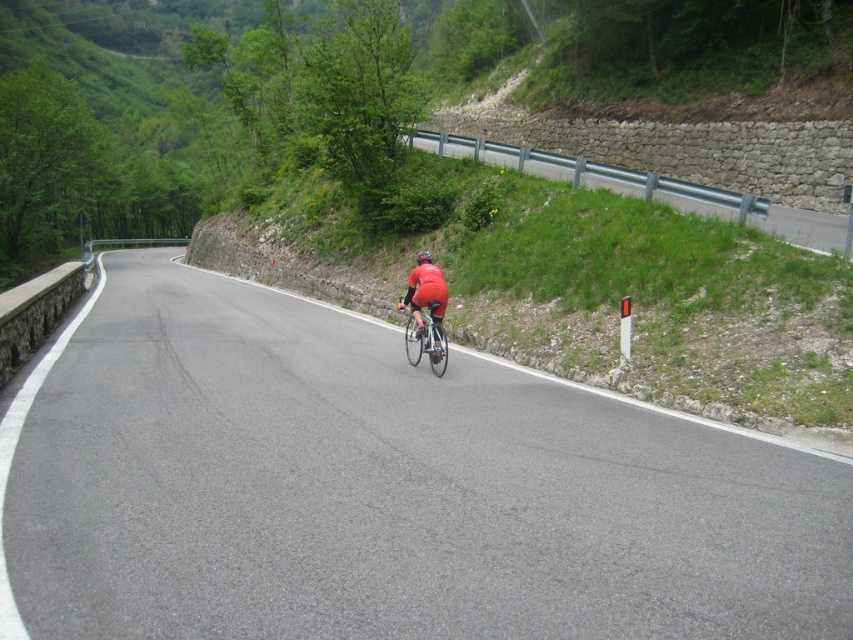
Does shiny metallic bicycle at center appear under matte red helmet at center?

Correct, shiny metallic bicycle at center is located below matte red helmet at center.

How much distance is there between shiny metallic bicycle at center and matte red helmet at center?

shiny metallic bicycle at center and matte red helmet at center are 1.66 meters apart from each other.

Is point (444, 348) positioned behind point (422, 259)?

No, it is in front of (422, 259).

The height and width of the screenshot is (640, 853). I want to click on shiny metallic bicycle at center, so click(425, 339).

Between point (764, 570) and point (415, 307), which one is positioned in front?

Point (764, 570)

From the picture: Which of these two, asphalt road at center or matte red cycling suit at center, stands taller?

asphalt road at center is taller.

Who is more forward, (x=200, y=468) or (x=437, y=289)?

Point (x=200, y=468) is more forward.

Locate an element on the screen. asphalt road at center is located at coordinates (381, 488).

In the scene shown: Can you confirm if asphalt road at center is taller than shiny metallic bicycle at center?

Yes, asphalt road at center is taller than shiny metallic bicycle at center.

Describe the element at coordinates (381, 488) in the screenshot. I see `asphalt road at center` at that location.

Which is behind, point (643, 628) or point (421, 340)?

The point (421, 340) is behind.

This screenshot has height=640, width=853. I want to click on asphalt road at center, so click(x=381, y=488).